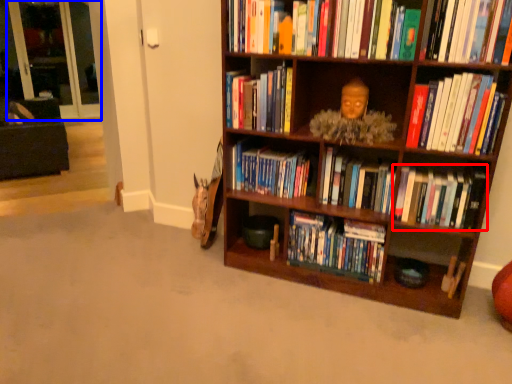
Question: Which object appears closest to the camera in this image, book (highlighted by a red box) or glass door (highlighted by a blue box)?

Choices:
 (A) book
 (B) glass door

Answer: (A)